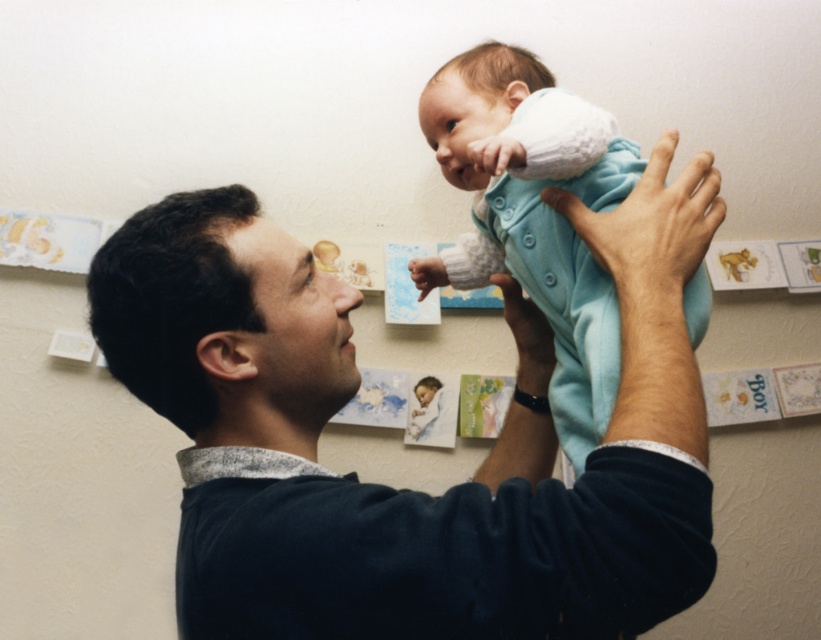
Is dark blue sweater at upper center closer to the viewer compared to light blue fleece onesie at upper center?

Yes, dark blue sweater at upper center is closer to the viewer.

Describe the element at coordinates (407, 490) in the screenshot. The width and height of the screenshot is (821, 640). I see `dark blue sweater at upper center` at that location.

Is point (301, 301) behind point (595, 388)?

No, it is not.

Where is `dark blue sweater at upper center`? dark blue sweater at upper center is located at coordinates (407, 490).